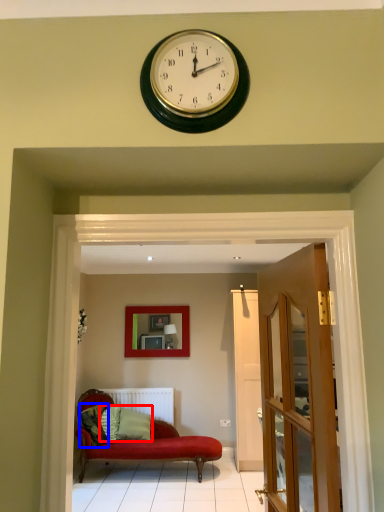
Question: Which point is closer to the camera, pillow (highlighted by a red box) or pillow (highlighted by a blue box)?

Choices:
 (A) pillow
 (B) pillow

Answer: (B)